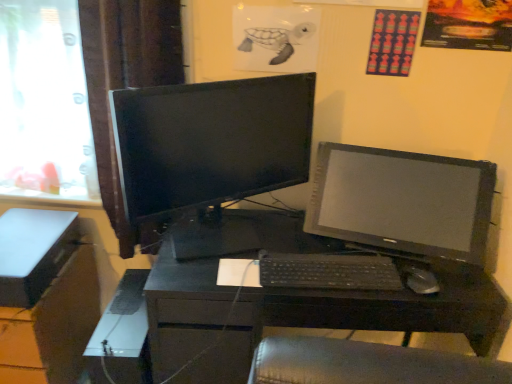
Question: Considering the relative sizes of satin black monitor at right, positioned as the first computer monitor in right-to-left order, and transparent glass window at left in the image provided, is satin black monitor at right, positioned as the first computer monitor in right-to-left order, thinner than transparent glass window at left?

Choices:
 (A) no
 (B) yes

Answer: (A)

Question: Does satin black monitor at right, placed as the 2th computer monitor when sorted from left to right, come behind transparent glass window at left?

Choices:
 (A) no
 (B) yes

Answer: (A)

Question: From the image's perspective, is satin black monitor at right, placed as the 2th computer monitor when sorted from left to right, beneath transparent glass window at left?

Choices:
 (A) no
 (B) yes

Answer: (B)

Question: Are satin black monitor at right, placed as the 2th computer monitor when sorted from left to right, and transparent glass window at left far apart?

Choices:
 (A) no
 (B) yes

Answer: (B)

Question: Is satin black monitor at right, placed as the 2th computer monitor when sorted from left to right, shorter than transparent glass window at left?

Choices:
 (A) no
 (B) yes

Answer: (B)

Question: From their relative heights in the image, would you say black plastic mouse at center is taller or shorter than white plastic computer tower at lower left?

Choices:
 (A) tall
 (B) short

Answer: (B)

Question: From the image's perspective, relative to white plastic computer tower at lower left, is black plastic mouse at center above or below?

Choices:
 (A) below
 (B) above

Answer: (B)

Question: In the image, is black plastic mouse at center on the left side or the right side of white plastic computer tower at lower left?

Choices:
 (A) left
 (B) right

Answer: (B)

Question: Is black plastic mouse at center spatially inside white plastic computer tower at lower left, or outside of it?

Choices:
 (A) outside
 (B) inside

Answer: (A)

Question: Looking at their shapes, would you say black glossy monitor at center, which is counted as the 1th computer monitor, starting from the left, is wider or thinner than black plastic keyboard at center?

Choices:
 (A) wide
 (B) thin

Answer: (A)

Question: In terms of height, does black glossy monitor at center, which is counted as the 1th computer monitor, starting from the left, look taller or shorter compared to black plastic keyboard at center?

Choices:
 (A) short
 (B) tall

Answer: (B)

Question: Considering their positions, is black glossy monitor at center, which is the 2th computer monitor in right-to-left order, located in front of or behind black plastic keyboard at center?

Choices:
 (A) front
 (B) behind

Answer: (A)

Question: Do you think black glossy monitor at center, which is the 2th computer monitor in right-to-left order, is within black plastic keyboard at center, or outside of it?

Choices:
 (A) outside
 (B) inside

Answer: (A)

Question: Based on their sizes in the image, would you say black glossy monitor at center, which is the 2th computer monitor in right-to-left order, is bigger or smaller than white plastic computer tower at lower left?

Choices:
 (A) small
 (B) big

Answer: (B)

Question: From a real-world perspective, is black glossy monitor at center, which is the 2th computer monitor in right-to-left order, physically located above or below white plastic computer tower at lower left?

Choices:
 (A) below
 (B) above

Answer: (B)